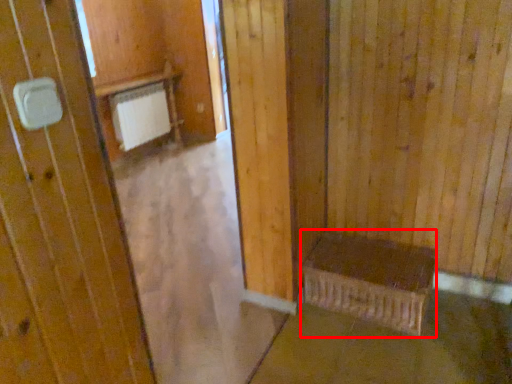
Question: From the image, what is the correct spatial relationship of furniture (annotated by the red box) in relation to concrete?

Choices:
 (A) left
 (B) right

Answer: (A)